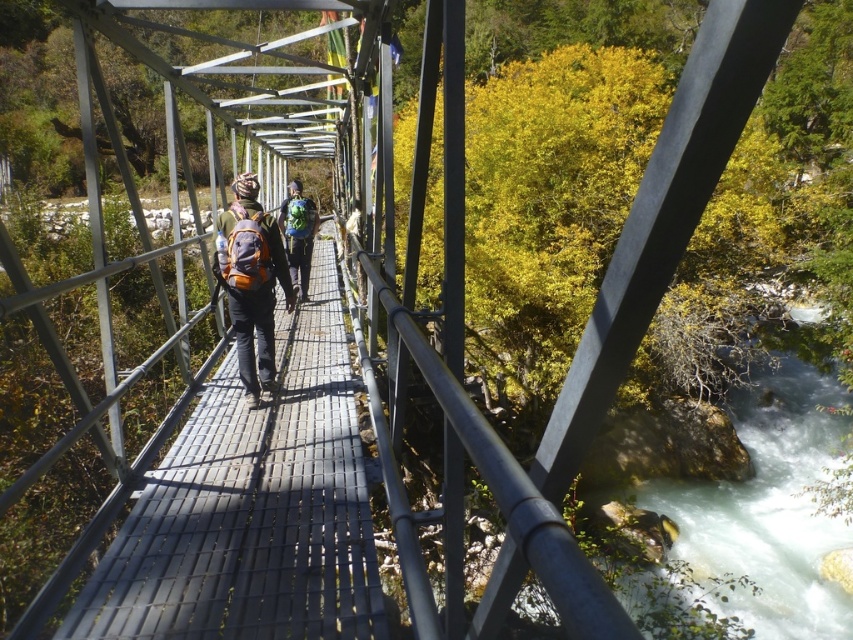
Question: Is matte orange backpack at center positioned behind matte green backpack at center?

Choices:
 (A) no
 (B) yes

Answer: (A)

Question: Is matte orange backpack at center above matte green backpack at center?

Choices:
 (A) yes
 (B) no

Answer: (B)

Question: Which point is farther to the camera?

Choices:
 (A) (257, 227)
 (B) (300, 241)

Answer: (B)

Question: Is matte orange backpack at center above matte green backpack at center?

Choices:
 (A) no
 (B) yes

Answer: (A)

Question: Which point is closer to the camera taking this photo?

Choices:
 (A) (x=297, y=232)
 (B) (x=218, y=266)

Answer: (B)